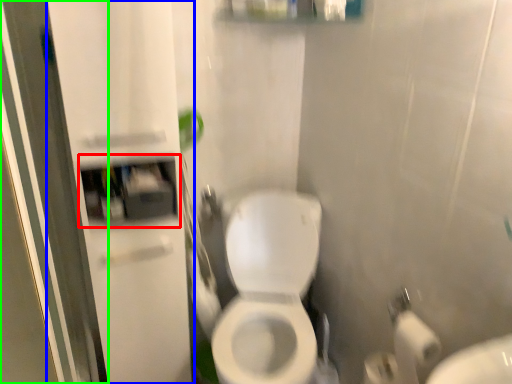
Question: Considering the real-world distances, which object is farthest from medicine cabinet (highlighted by a red box)? screen door (highlighted by a blue box) or screen door (highlighted by a green box)?

Choices:
 (A) screen door
 (B) screen door

Answer: (B)